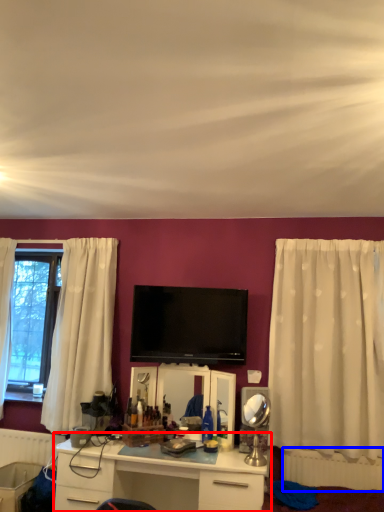
Question: Which object is further to the camera taking this photo, desk (highlighted by a red box) or radiator (highlighted by a blue box)?

Choices:
 (A) desk
 (B) radiator

Answer: (B)